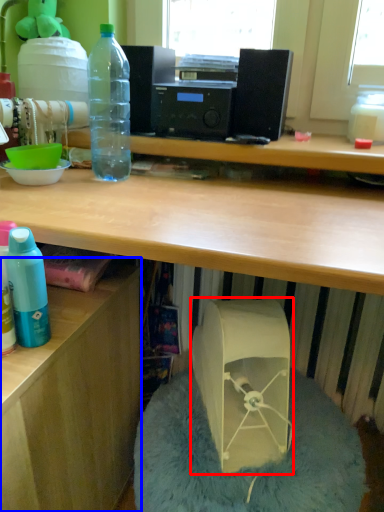
Question: Among these objects, which one is nearest to the camera, wide (highlighted by a red box) or desk (highlighted by a blue box)?

Choices:
 (A) wide
 (B) desk

Answer: (B)